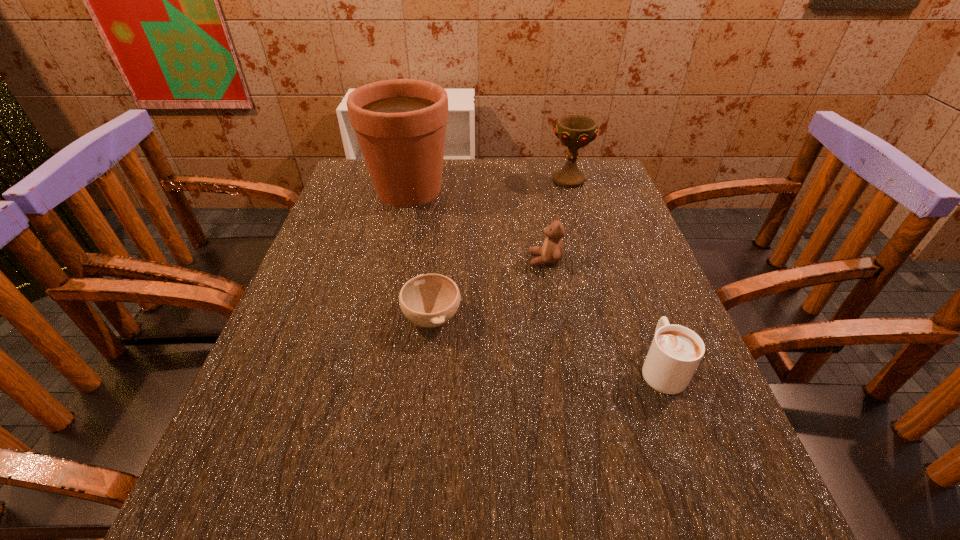
The height and width of the screenshot is (540, 960). I want to click on free space between the fourth shortest object and the fourth tallest object, so click(614, 273).

The image size is (960, 540). In order to click on vacant point located between the cappuccino and the second tallest object in this screenshot , I will do `click(614, 273)`.

Locate an element on the screen. This screenshot has height=540, width=960. vacant space in between the flowerpot and the second shortest object is located at coordinates (535, 279).

In order to click on free space between the flowerpot and the third shortest object in this screenshot , I will do `click(477, 225)`.

I want to click on unoccupied position between the flowerpot and the chalice, so click(489, 185).

The image size is (960, 540). What are the coordinates of `vacant area between the tallest object and the chalice` in the screenshot? It's located at (489, 185).

Find the location of a particular element. object that is the fourth nearest to the fourth tallest object is located at coordinates (400, 124).

Select which object appears as the third closest to the cappuccino. Please provide its 2D coordinates. Your answer should be formatted as a tuple, i.e. [(x, y)], where the tuple contains the x and y coordinates of a point satisfying the conditions above.

[(574, 131)]

Find the location of a particular element. The width and height of the screenshot is (960, 540). vacant area that satisfies the following two spatial constraints: 1. on the side with the handle of the cappuccino; 2. on the front-facing side of the teddy bear is located at coordinates (621, 260).

This screenshot has width=960, height=540. What are the coordinates of `free space that satisfies the following two spatial constraints: 1. on the front-facing side of the third tallest object; 2. on the side with the handle of the cappuccino` in the screenshot? It's located at click(564, 367).